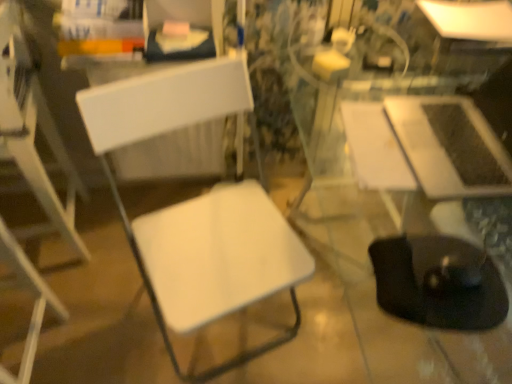
At what (x,y) coordinates should I click in order to perform the action: click on free spot below white plastic chair at left, the 1th chair when ordered from left to right (from a real-world perspective). Please return your answer as a coordinate pair (x, y). Looking at the image, I should click on (39, 354).